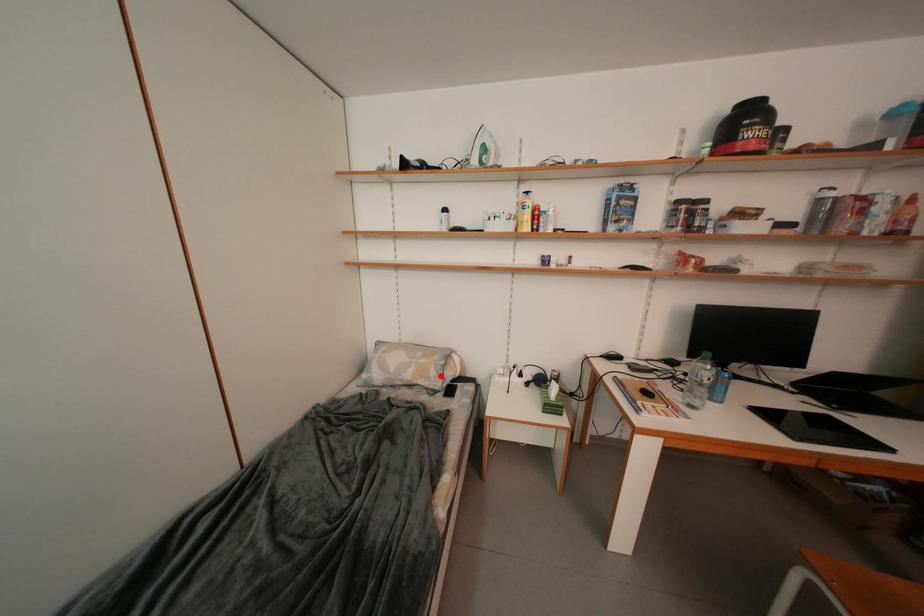
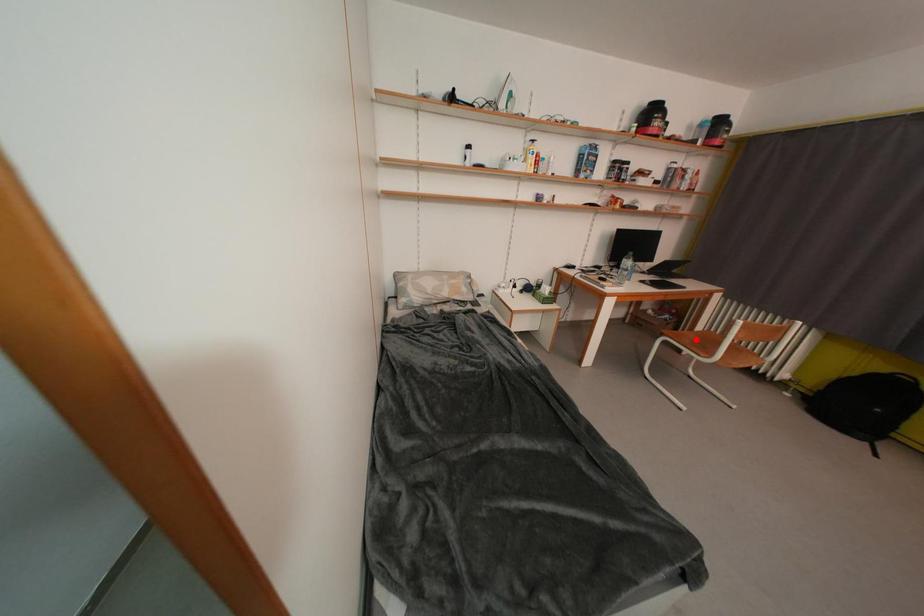
I am providing you with two images of the same scene from different viewpoints. A red point is marked on the first image and another point is marked on the second image. Does the point marked in image1 correspond to the same location as the one in image2?

No